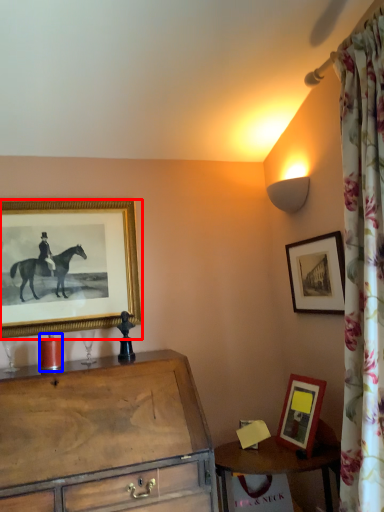
Question: Which object is closer to the camera taking this photo, picture frame (highlighted by a red box) or candle holder (highlighted by a blue box)?

Choices:
 (A) picture frame
 (B) candle holder

Answer: (B)